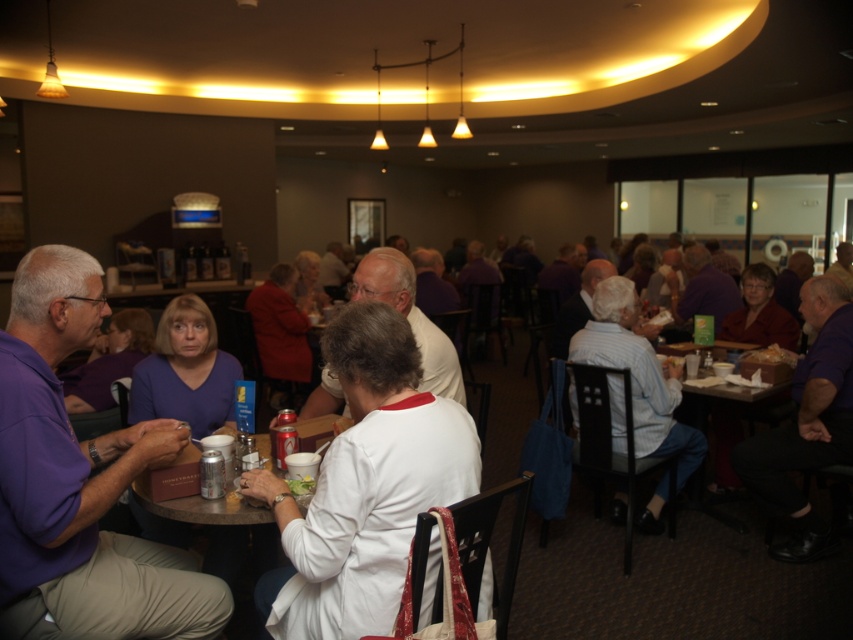
Question: Among these objects, which one is nearest to the camera?

Choices:
 (A) purple shirt at right
 (B) green leafy salad at center
 (C) white cotton shirt at center

Answer: (B)

Question: Is purple shirt at right below green leafy salad at center?

Choices:
 (A) no
 (B) yes

Answer: (A)

Question: Which object appears farthest from the camera in this image?

Choices:
 (A) wooden table at center
 (B) white cotton shirt at center

Answer: (A)

Question: In this image, where is white cotton shirt at center located relative to metallic silver table at center?

Choices:
 (A) below
 (B) above

Answer: (B)

Question: Among these objects, which one is farthest from the camera?

Choices:
 (A) white cotton shirt at center
 (B) white matte shirt at center
 (C) wooden table at center
 (D) matte purple shirt at center

Answer: (C)

Question: Does metallic silver table at center appear on the left side of green leafy salad at center?

Choices:
 (A) yes
 (B) no

Answer: (A)